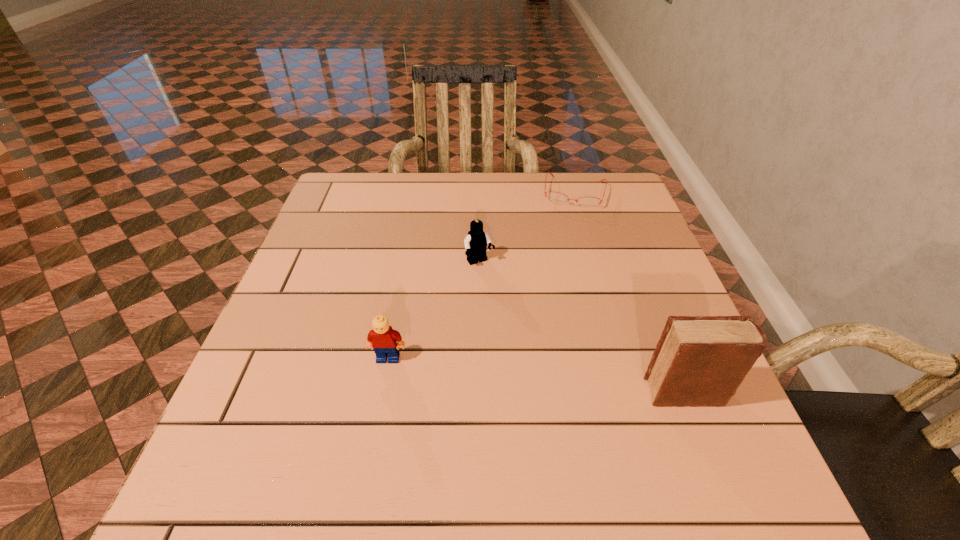
You are a GUI agent. You are given a task and a screenshot of the screen. Output one action in this format:
    pyautogui.click(x=<x>, y=<y>)
    Task: Click on the nearer Lego
    
    Given the screenshot: What is the action you would take?
    pyautogui.click(x=386, y=342)

Locate an element on the screen. This screenshot has height=540, width=960. the leftmost object is located at coordinates (386, 342).

Find the location of a particular element. The width and height of the screenshot is (960, 540). diary is located at coordinates (700, 361).

Where is `the nearest object`? The height and width of the screenshot is (540, 960). the nearest object is located at coordinates (700, 361).

I want to click on the second farthest object, so click(x=476, y=241).

Identify the location of the farther Lego. The image size is (960, 540). (476, 241).

At what (x,y) coordinates should I click in order to perform the action: click on the farthest object. Please return your answer as a coordinate pair (x, y). Looking at the image, I should click on (557, 198).

The width and height of the screenshot is (960, 540). I want to click on spectacles, so click(557, 198).

Find the location of a particular element. The image size is (960, 540). free space located on the front-facing side of the second nearest object is located at coordinates (377, 415).

The width and height of the screenshot is (960, 540). In order to click on vacant space located on the front-facing side of the farther Lego in this screenshot , I will do `click(504, 297)`.